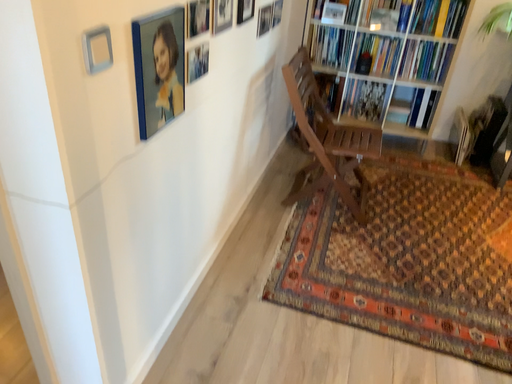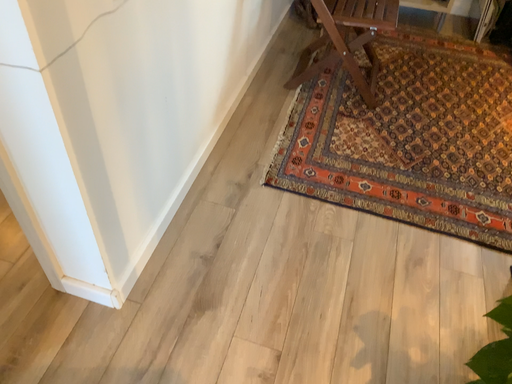
Question: How did the camera likely rotate when shooting the video?

Choices:
 (A) rotated downward
 (B) rotated upward

Answer: (A)